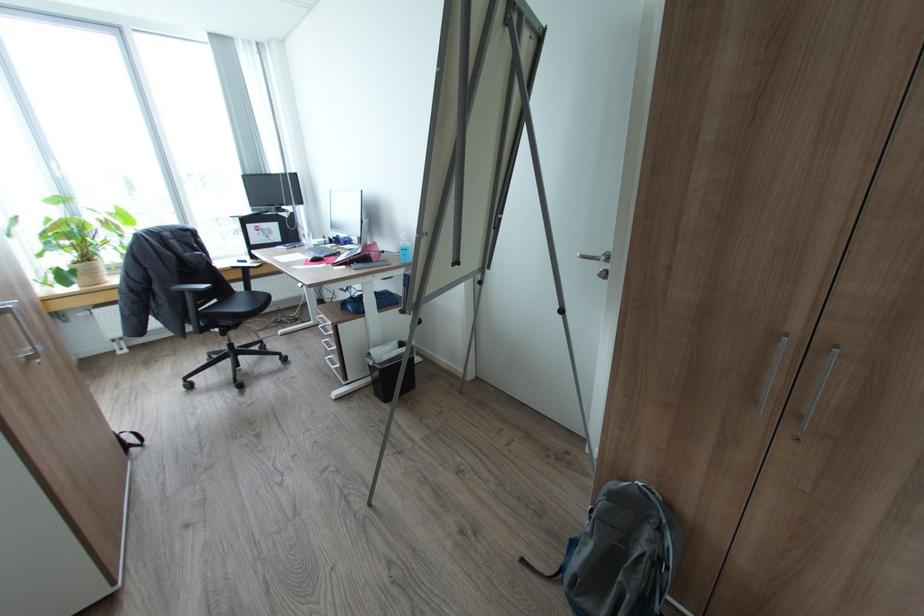
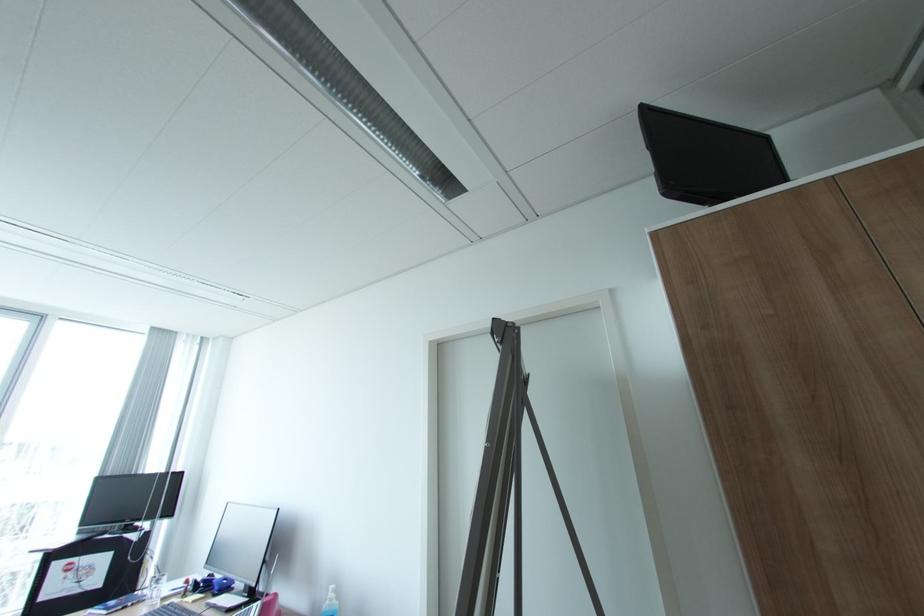
Find the pixel in the second image that matches pixel 313 243 in the first image.

(160, 596)